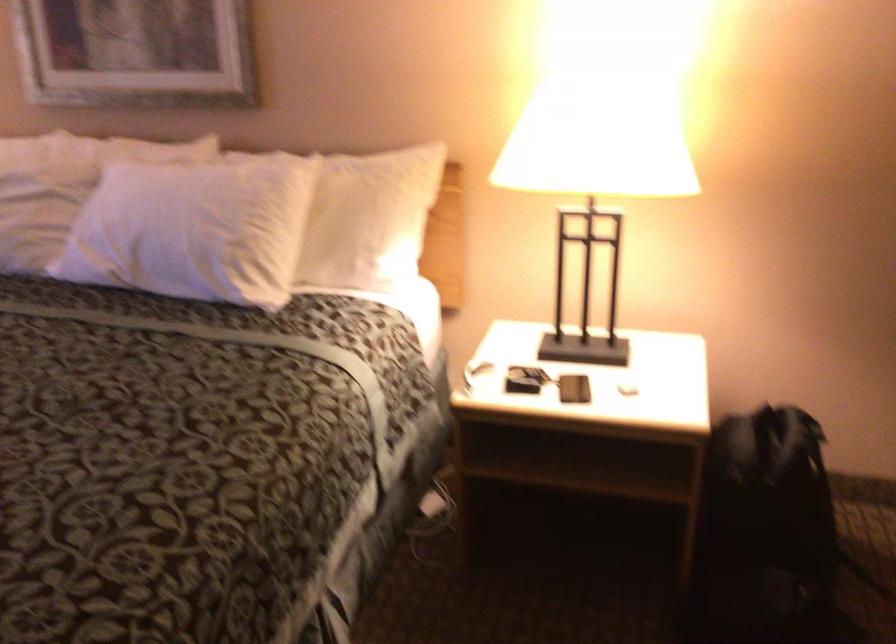
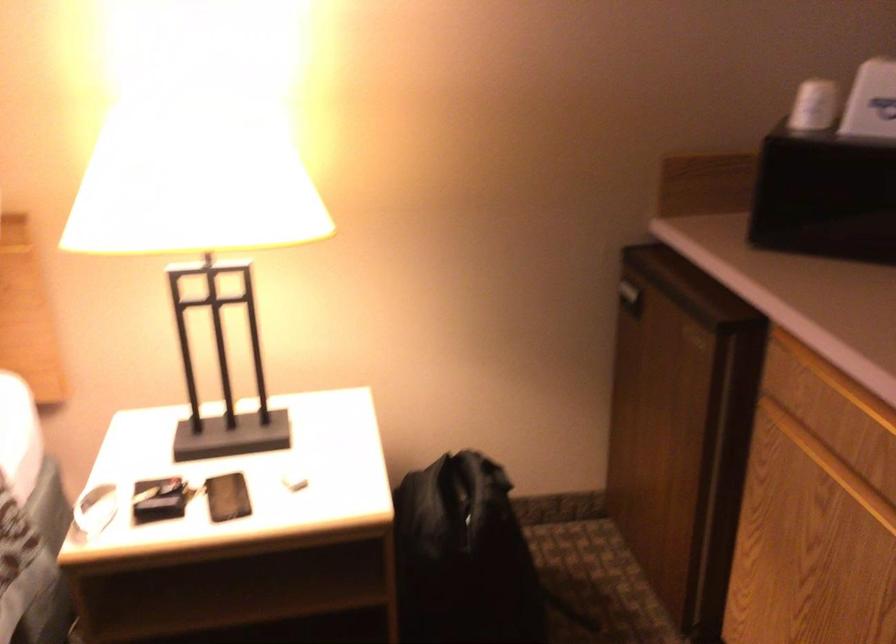
Question: The images are taken continuously from a first-person perspective. In which direction is your viewpoint rotating?

Choices:
 (A) Left
 (B) Right
 (C) Up
 (D) Down

Answer: (B)